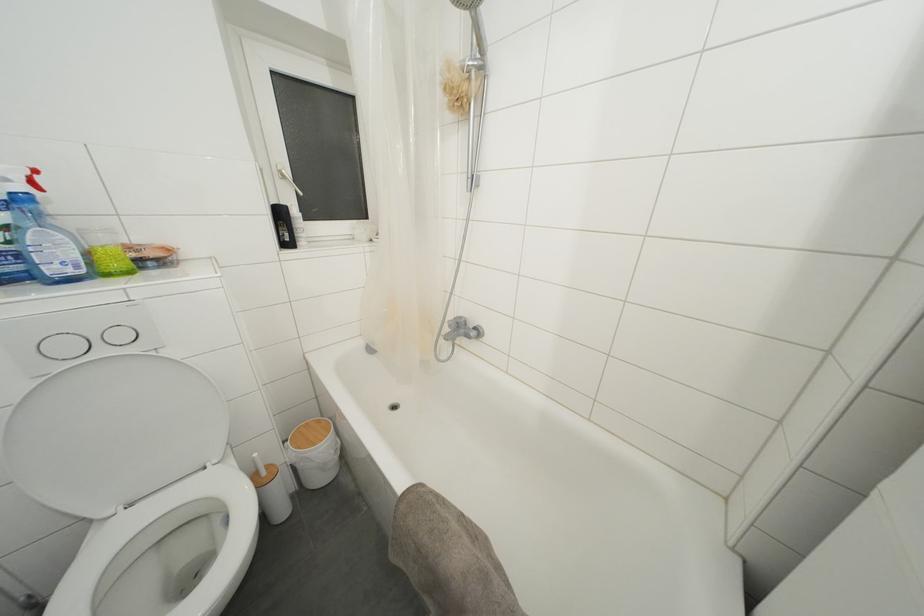
Image resolution: width=924 pixels, height=616 pixels. Describe the element at coordinates (287, 179) in the screenshot. I see `the white window handle` at that location.